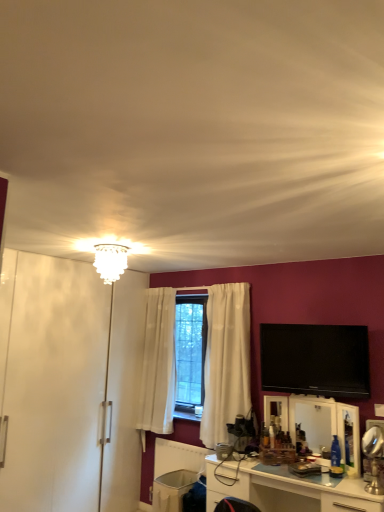
Locate an element on the screen. free space above clear glass mirror at center (from a real-world perspective) is located at coordinates (312, 393).